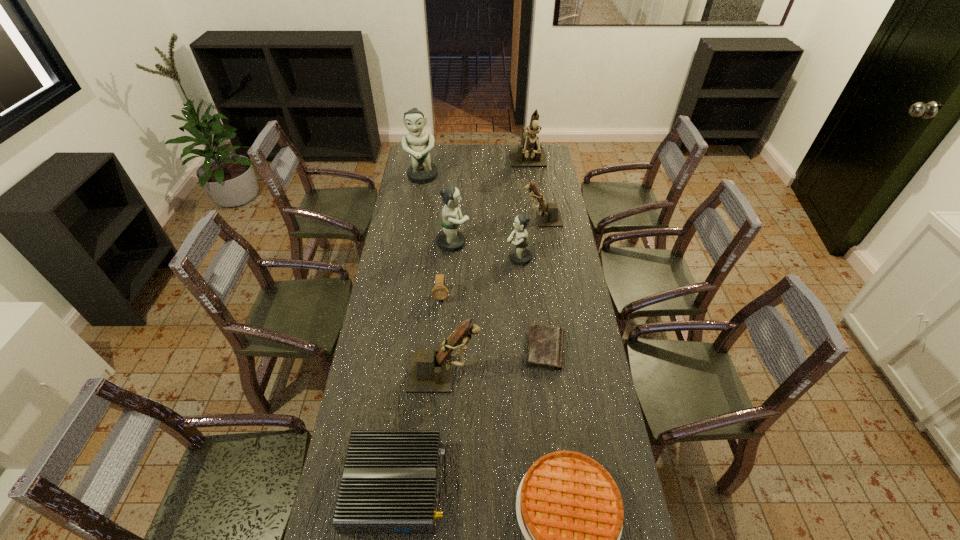
I want to click on free space between the shortest object and the second smallest green figurine, so click(x=499, y=296).

You are a GUI agent. You are given a task and a screenshot of the screen. Output one action in this format:
    pyautogui.click(x=<x>, y=<y>)
    Task: Click on the vacant area between the farthest brown figurine and the smallest green figurine
    
    Given the screenshot: What is the action you would take?
    pyautogui.click(x=524, y=211)

Identify the location of object identified as the fifth closest to the nearest brown figurine. (520, 255).

Locate an element on the screen. The height and width of the screenshot is (540, 960). object identified as the eighth closest to the diary is located at coordinates (528, 154).

Image resolution: width=960 pixels, height=540 pixels. What are the coordinates of `figurine that is the sixth closest one to the router` in the screenshot? It's located at (528, 154).

Identify the location of figurine identified as the third closest to the eighth tallest object. (450, 240).

Identify the location of green figurine identified as the closest to the second green figurine from right to left. Image resolution: width=960 pixels, height=540 pixels. (520, 255).

Identify which green figurine is the nearest to the rightmost green figurine. Please provide its 2D coordinates. Your answer should be formatted as a tuple, i.e. [(x, y)], where the tuple contains the x and y coordinates of a point satisfying the conditions above.

[(450, 240)]

Image resolution: width=960 pixels, height=540 pixels. I want to click on brown figurine that is the third closest one to the sixth farthest object, so click(528, 154).

Identify which brown figurine is the second closest to the fourth nearest figurine. Please provide its 2D coordinates. Your answer should be formatted as a tuple, i.e. [(x, y)], where the tuple contains the x and y coordinates of a point satisfying the conditions above.

[(430, 371)]